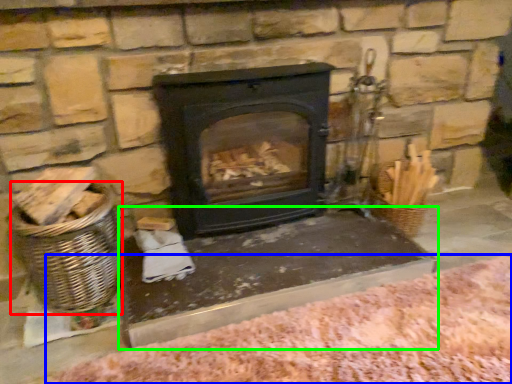
Question: Which object is positioned closest to basket (highlighted by a red box)? Select from blanket (highlighted by a blue box) and table (highlighted by a green box).

Choices:
 (A) blanket
 (B) table

Answer: (B)